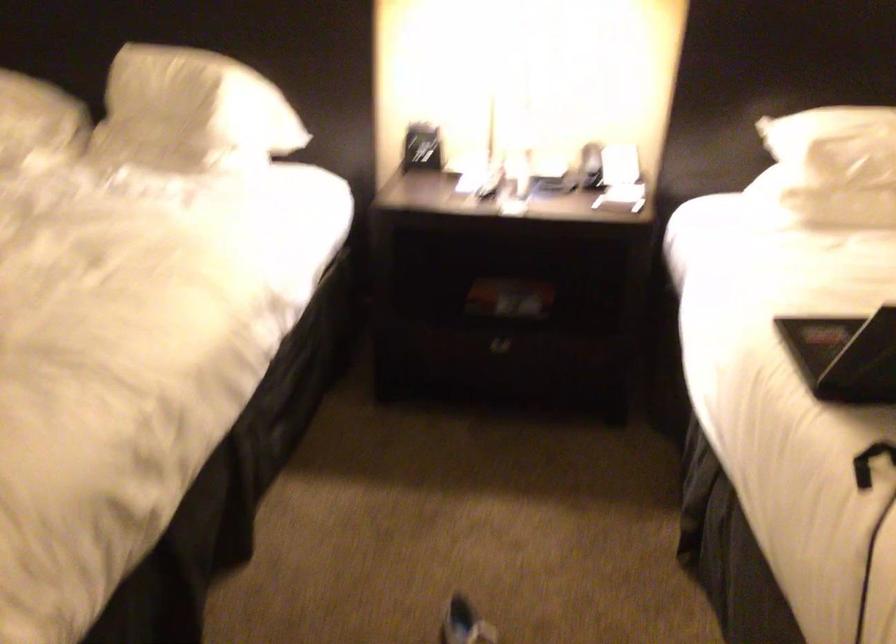
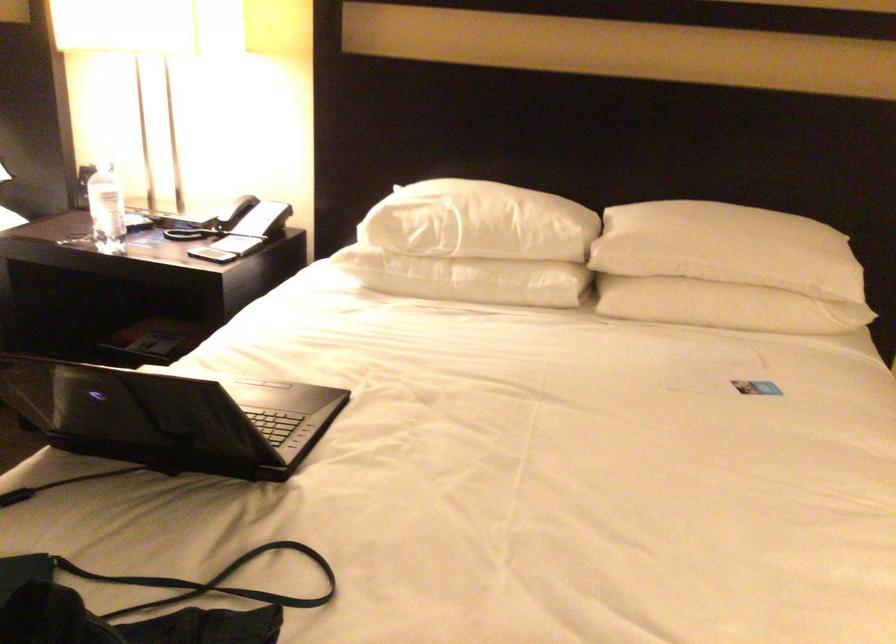
Where in the second image is the point corresponding to point 607,192 from the first image?

(211, 249)